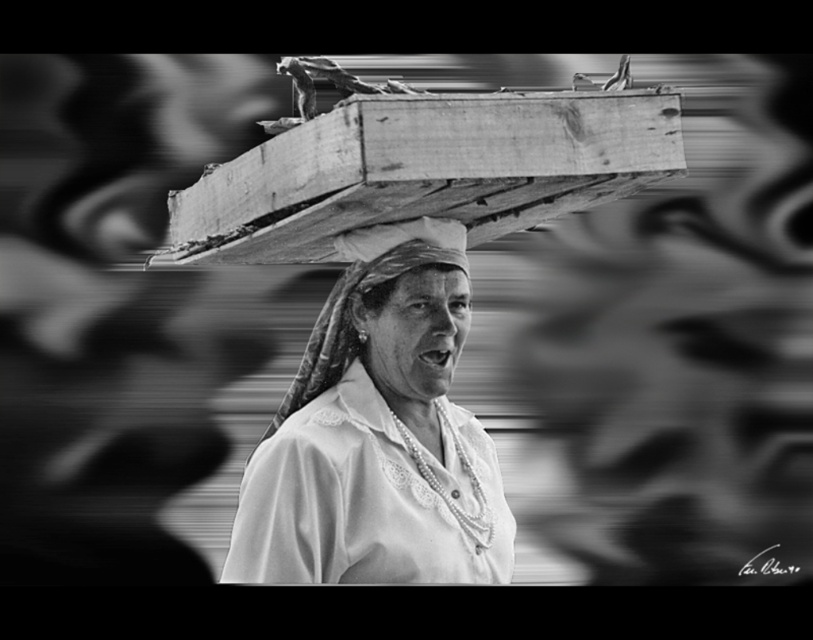
You are a photographer analyzing the composition of this black and white photo. The woman is positioned in the center with a load on her head. Where is the white lace shirt at center in relation to the edges of the image?

The white lace shirt at center is located at point coordinates 0.678 along the horizontal axis and 0.466 along the vertical axis, placing it near the center of the image.

Based on the scene description, which object is bigger between the white lace shirt at center and the smooth fabric headscarf at center?

The white lace shirt at center is larger in size than the smooth fabric headscarf at center.

You are a photographer analyzing the composition of this black and white photo. You notice a specific point at coordinates (377, 433). Based on the scene description, what object is located at that point?

The point at coordinates (377, 433) corresponds to the white lace shirt at center, as stated in the objects description.